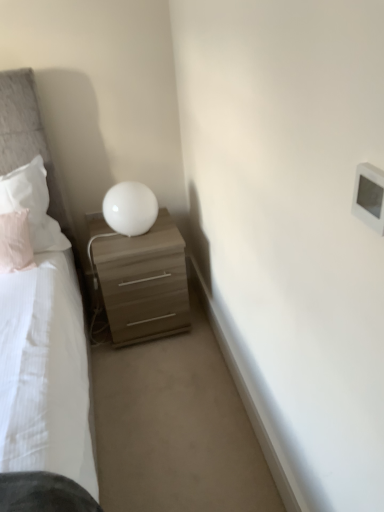
Question: Considering the relative sizes of white plastic light switch at upper right and light brown wood nightstand at center in the image provided, is white plastic light switch at upper right smaller than light brown wood nightstand at center?

Choices:
 (A) yes
 (B) no

Answer: (A)

Question: Is white plastic light switch at upper right in contact with light brown wood nightstand at center?

Choices:
 (A) yes
 (B) no

Answer: (B)

Question: From a real-world perspective, is white plastic light switch at upper right positioned over light brown wood nightstand at center based on gravity?

Choices:
 (A) no
 (B) yes

Answer: (B)

Question: Is white plastic light switch at upper right looking in the opposite direction of light brown wood nightstand at center?

Choices:
 (A) no
 (B) yes

Answer: (A)

Question: Is white plastic light switch at upper right surrounding light brown wood nightstand at center?

Choices:
 (A) yes
 (B) no

Answer: (B)

Question: In the image, is white soft pillow at left, which appears as the second pillow when ordered from the bottom, positioned in front of or behind light brown wood nightstand at center?

Choices:
 (A) behind
 (B) front

Answer: (B)

Question: From their relative heights in the image, would you say white soft pillow at left, acting as the 1th pillow starting from the top, is taller or shorter than light brown wood nightstand at center?

Choices:
 (A) short
 (B) tall

Answer: (A)

Question: From a real-world perspective, relative to light brown wood nightstand at center, is white soft pillow at left, which appears as the second pillow when ordered from the bottom, vertically above or below?

Choices:
 (A) below
 (B) above

Answer: (B)

Question: Looking at the image, does white soft pillow at left, which appears as the second pillow when ordered from the bottom, seem bigger or smaller compared to light brown wood nightstand at center?

Choices:
 (A) small
 (B) big

Answer: (A)

Question: Which is correct: pink fabric pillow at left, the 1th pillow in the bottom-to-top sequence, is inside white soft pillow at left, which appears as the second pillow when ordered from the bottom, or outside of it?

Choices:
 (A) inside
 (B) outside

Answer: (B)

Question: Is point (11, 260) positioned closer to the camera than point (1, 203)?

Choices:
 (A) closer
 (B) farther

Answer: (A)

Question: From the image's perspective, is pink fabric pillow at left, the 1th pillow in the bottom-to-top sequence, above or below white soft pillow at left, which appears as the second pillow when ordered from the bottom?

Choices:
 (A) below
 (B) above

Answer: (A)

Question: In the image, is pink fabric pillow at left, which ranks as the second pillow in top-to-bottom order, positioned in front of or behind white soft pillow at left, acting as the 1th pillow starting from the top?

Choices:
 (A) behind
 (B) front

Answer: (B)

Question: From the image's perspective, is white glossy sphere at upper right located above or below light brown wood nightstand at center?

Choices:
 (A) above
 (B) below

Answer: (A)

Question: Based on their positions, is white glossy sphere at upper right located to the left or right of light brown wood nightstand at center?

Choices:
 (A) left
 (B) right

Answer: (A)